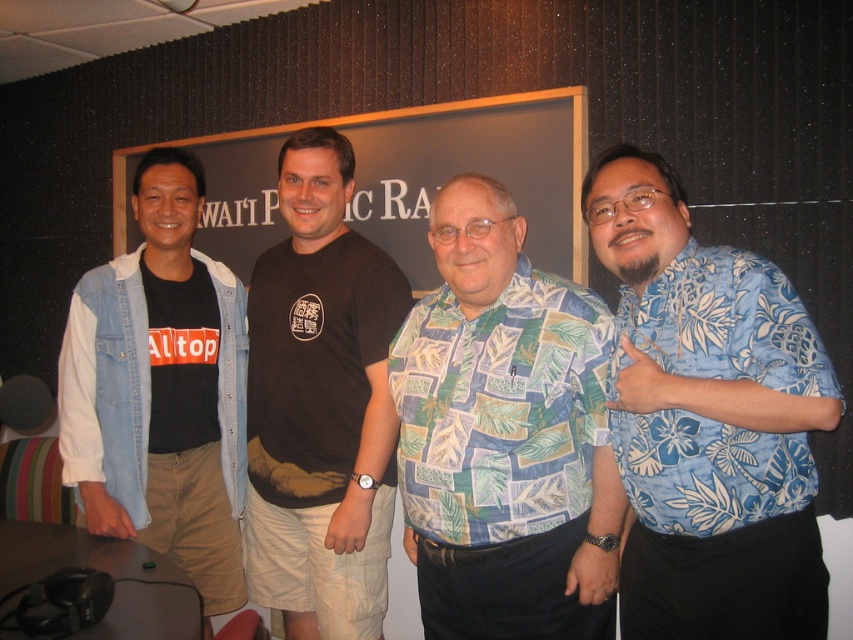
Between point (665, 369) and point (331, 620), which one is positioned in front?

Positioned in front is point (665, 369).

Is blue floral shirt at right positioned in front of black cotton t-shirt at center?

Yes, blue floral shirt at right is closer to the viewer.

Is point (758, 506) behind point (341, 499)?

No, it is not.

Locate an element on the screen. The height and width of the screenshot is (640, 853). blue floral shirt at right is located at coordinates (709, 420).

Can you confirm if printed fabric shirt at center is positioned below denim jacket at left?

No.

Is point (477, 244) closer to camera compared to point (227, 419)?

Yes, it is.

The image size is (853, 640). I want to click on printed fabric shirt at center, so click(505, 435).

Who is taller, black cotton t-shirt at center or matte black signboard at center?

black cotton t-shirt at center

Can you confirm if black cotton t-shirt at center is positioned to the left of matte black signboard at center?

Yes, black cotton t-shirt at center is to the left of matte black signboard at center.

Locate an element on the screen. black cotton t-shirt at center is located at coordinates (321, 404).

You are a GUI agent. You are given a task and a screenshot of the screen. Output one action in this format:
    pyautogui.click(x=<x>, y=<y>)
    Task: Click on the black cotton t-shirt at center
    The image size is (853, 640).
    Given the screenshot: What is the action you would take?
    pyautogui.click(x=321, y=404)